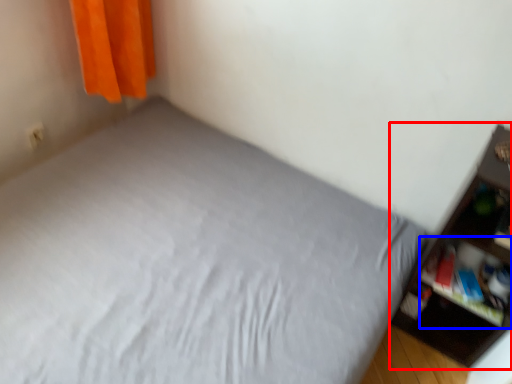
Question: Which object is further to the camera taking this photo, shelf (highlighted by a red box) or cabinet (highlighted by a blue box)?

Choices:
 (A) shelf
 (B) cabinet

Answer: (B)